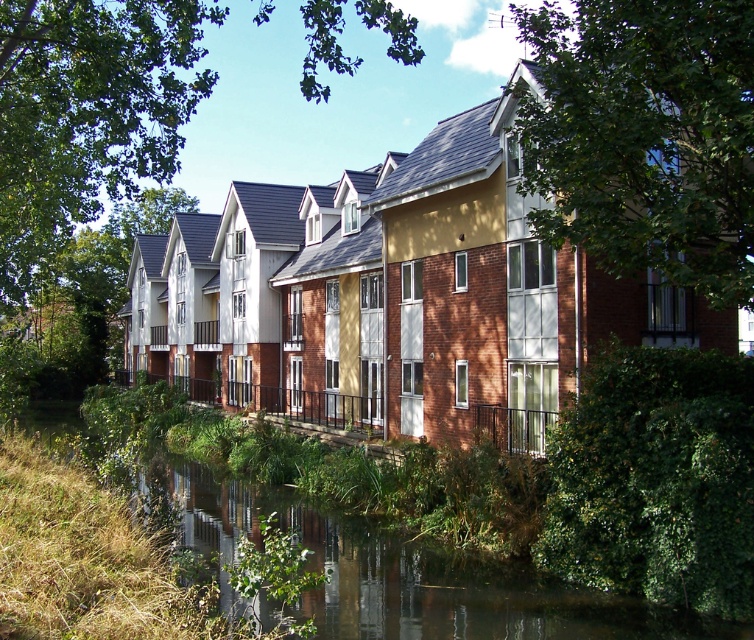
You are a drone operator trying to capture a photo of the green leafy tree at upper left and the green grassy bank at lower left. From your current position above the waterway, which object is positioned more to the left side of the image?

The green leafy tree at upper left is positioned more to the left than the green grassy bank at lower left.

From the picture: You are an urban planner analyzing the layout of this residential area. You notice two green leafy trees in the image. Which tree, the green leafy tree at upper center or the green leafy tree at upper left, is the smaller one?

The green leafy tree at upper center is smaller than the green leafy tree at upper left.

You are a delivery drone with a wingspan of 1.5 meters. You need to fly between the two points marked as point (651,188). Is there enough space for you to pass through safely?

The distance between the two points marked as point (651,188) is 11.55 meters. Since your wingspan is only 1.5 meters, there is sufficient space for you to pass through safely.